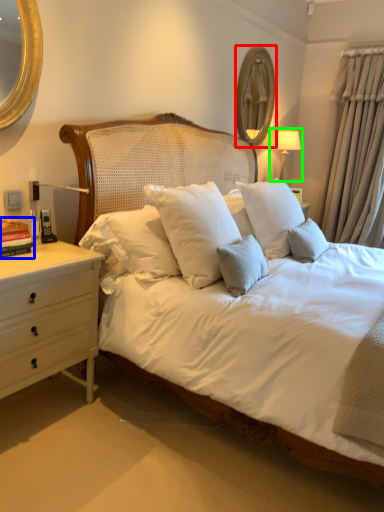
Question: Estimate the real-world distances between objects in this image. Which object is farther from mirror (highlighted by a red box), book (highlighted by a blue box) or bedside lamp (highlighted by a green box)?

Choices:
 (A) book
 (B) bedside lamp

Answer: (A)